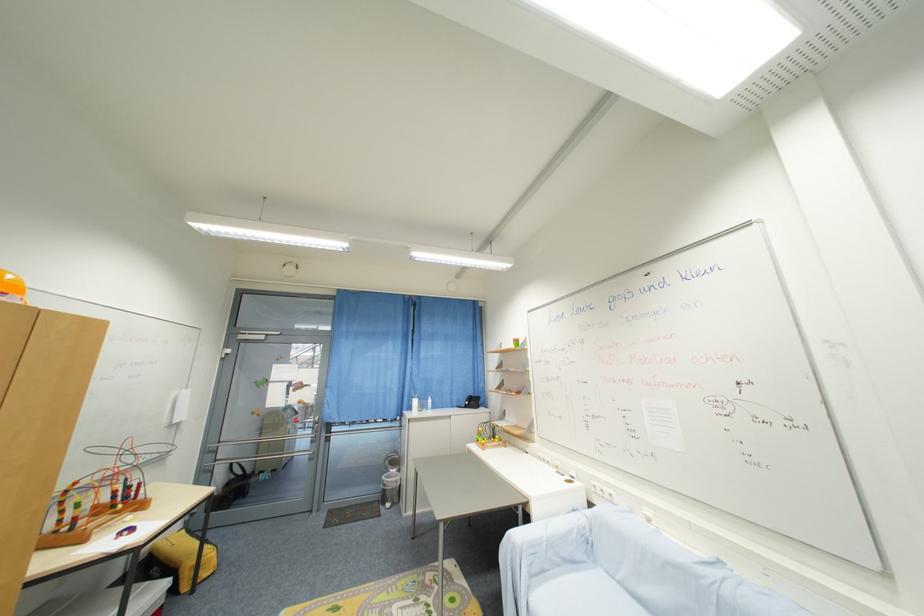
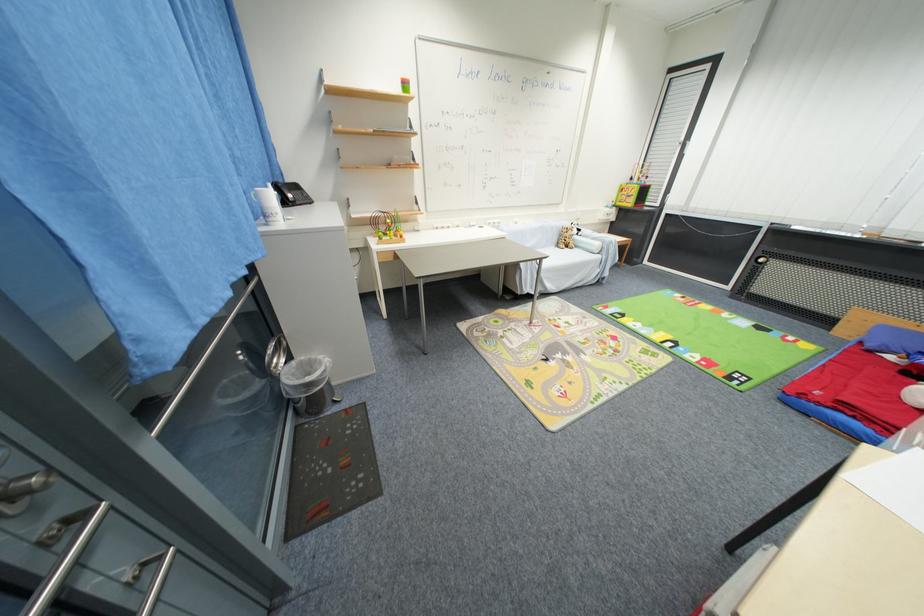
In the second image, find the point that corresponds to point (405, 472) in the first image.

(295, 360)